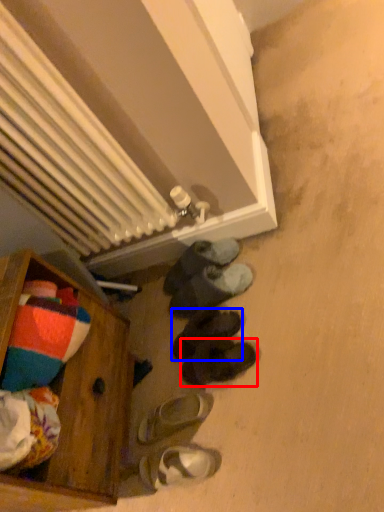
Question: Which object appears closest to the camera in this image, footwear (highlighted by a red box) or footwear (highlighted by a blue box)?

Choices:
 (A) footwear
 (B) footwear

Answer: (A)